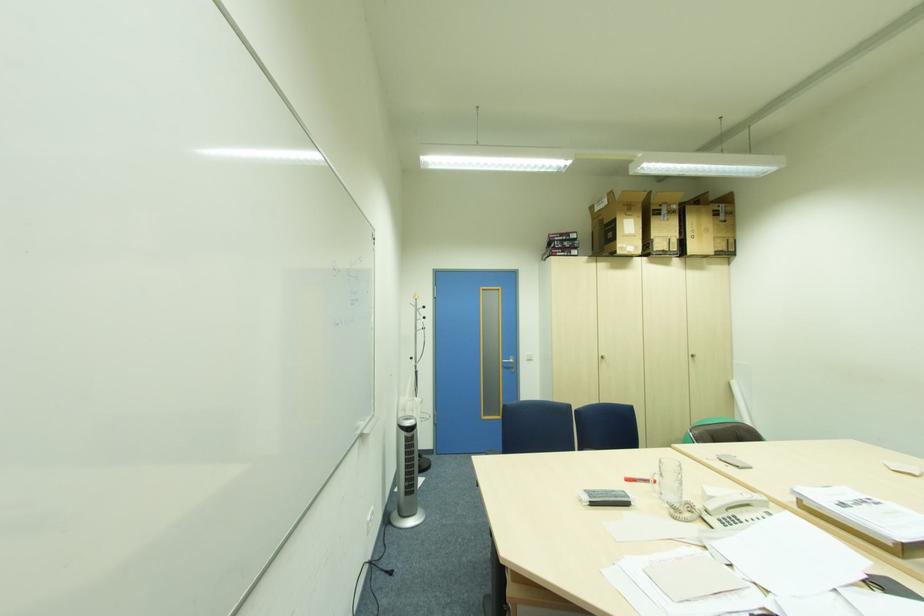
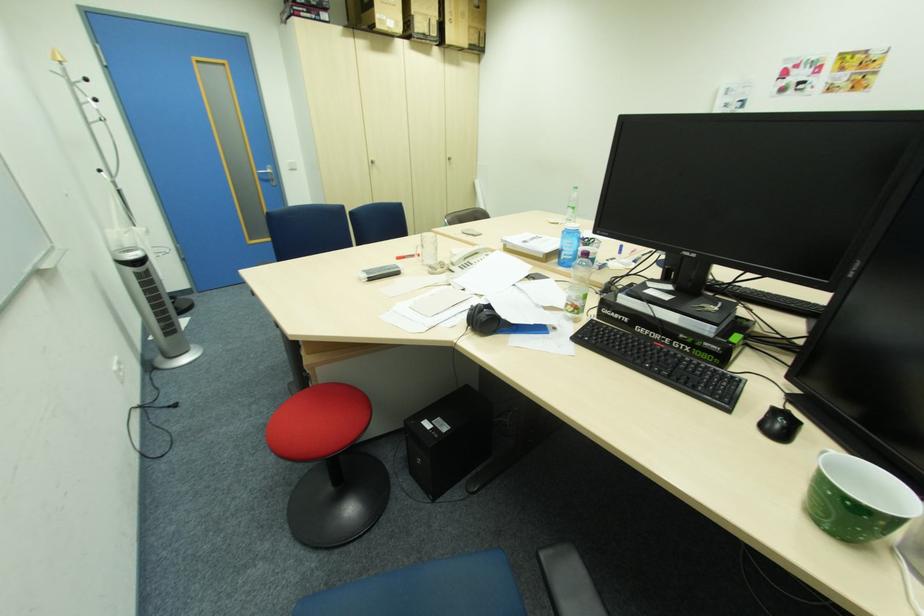
The point at [508,363] is marked in the first image. Where is the corresponding point in the second image?

(264, 174)